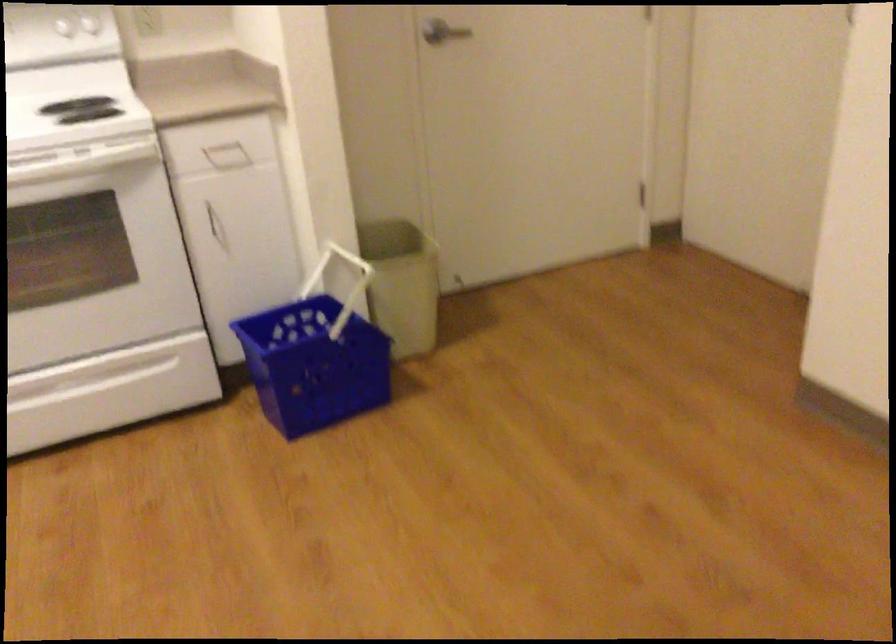
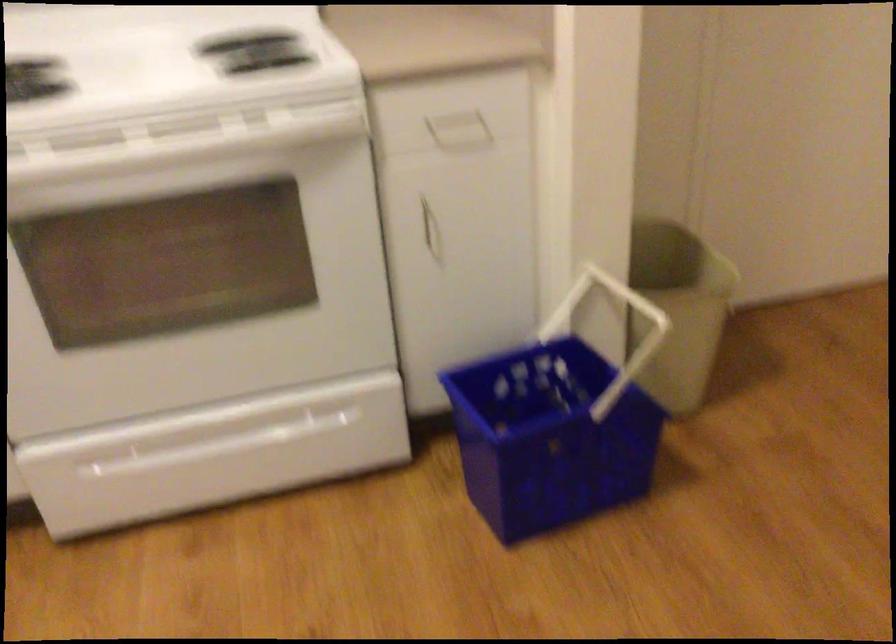
Where in the second image is the point corresponding to the point at 218,230 from the first image?

(431, 234)